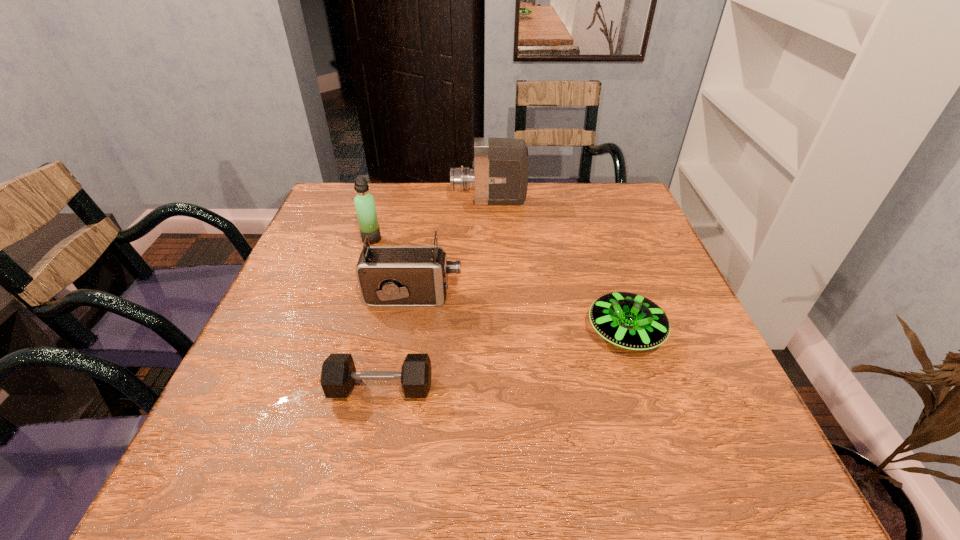
The height and width of the screenshot is (540, 960). In the image, there is a desktop. In order to click on vacant area at the far right corner in this screenshot , I will do `click(607, 187)`.

Identify the location of vacant space that is in between the farther camcorder and the rightmost object. (557, 267).

Locate an element on the screen. free point between the fourth nearest object and the saucer is located at coordinates (498, 286).

You are a GUI agent. You are given a task and a screenshot of the screen. Output one action in this format:
    pyautogui.click(x=<x>, y=<y>)
    Task: Click on the unoccupied position between the nearer camcorder and the rightmost object
    The width and height of the screenshot is (960, 540).
    Given the screenshot: What is the action you would take?
    pyautogui.click(x=519, y=315)

Locate an element on the screen. The width and height of the screenshot is (960, 540). blank region between the saucer and the farther camcorder is located at coordinates (557, 267).

I want to click on free space between the nearer camcorder and the nearest object, so tap(397, 342).

Find the location of a particular element. blank region between the nearer camcorder and the farther camcorder is located at coordinates (451, 249).

Locate an element on the screen. This screenshot has width=960, height=540. unoccupied position between the nearer camcorder and the dumbbell is located at coordinates (397, 342).

Image resolution: width=960 pixels, height=540 pixels. Identify the location of vacant space that is in between the nearest object and the fourth nearest object. (376, 314).

Where is `vacant area that lies between the nearer camcorder and the rightmost object`? The width and height of the screenshot is (960, 540). vacant area that lies between the nearer camcorder and the rightmost object is located at coordinates (519, 315).